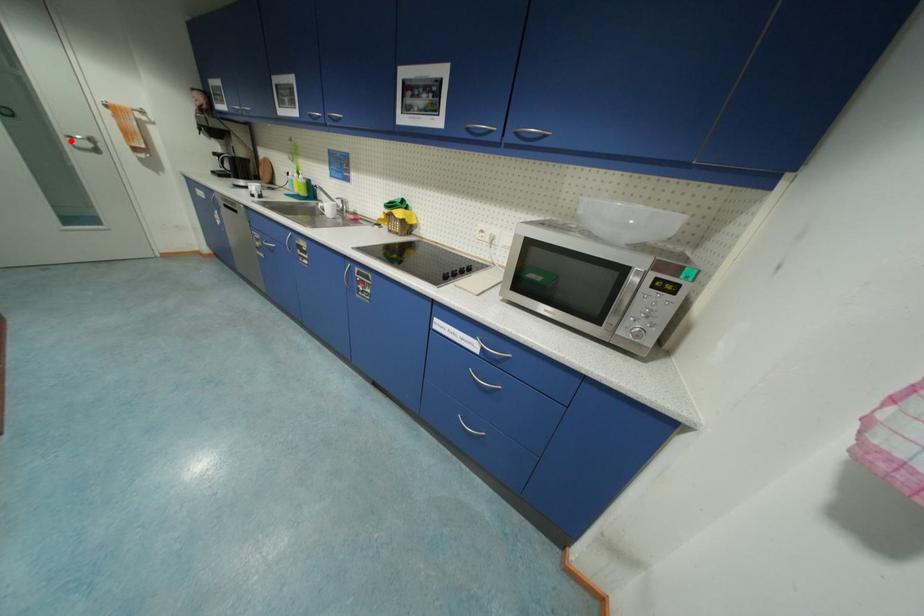
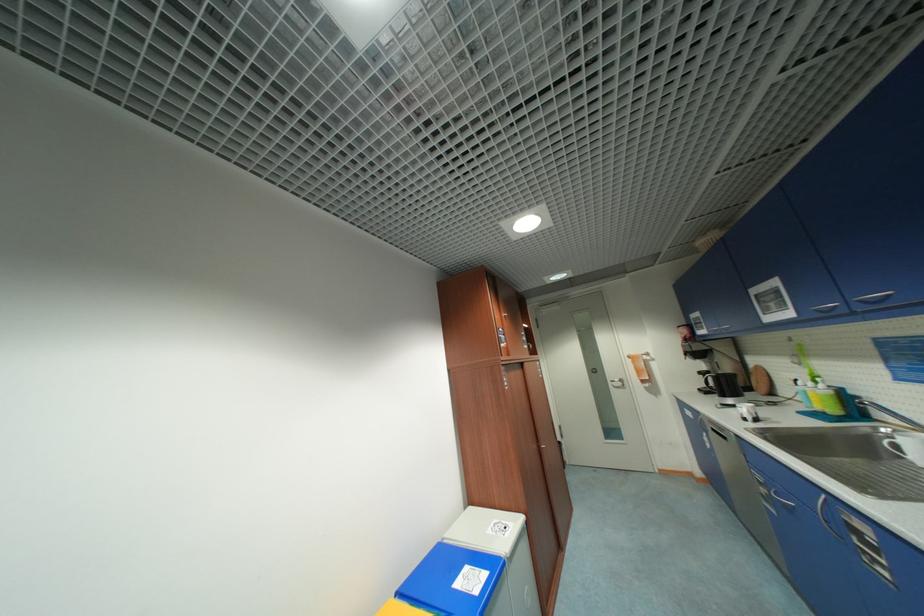
Question: I am providing you with two images of the same scene from different viewpoints. In image1, a red point is highlighted. Considering the same 3D point in image2, which of the following is correct?

Choices:
 (A) It is closer
 (B) It is farther

Answer: (A)